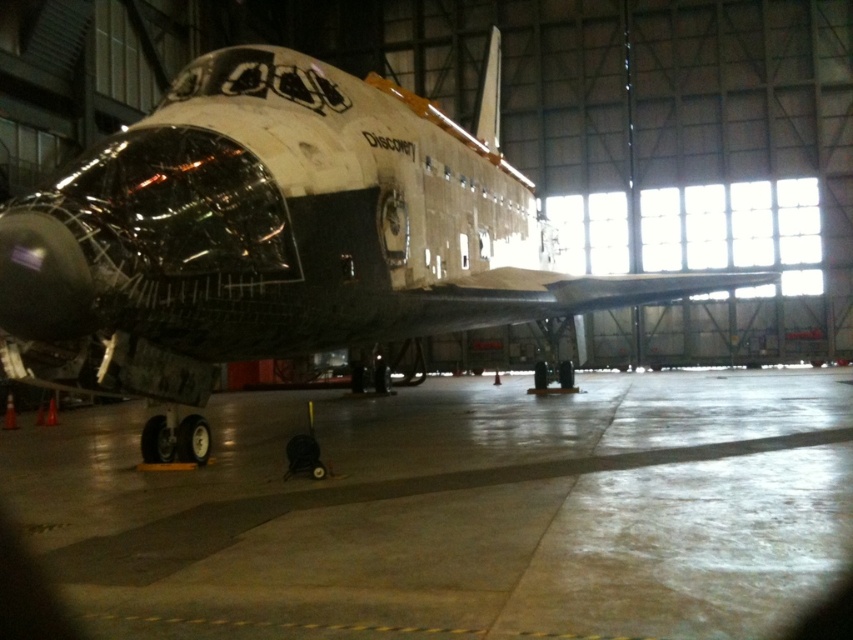
Looking at this image, you are standing at the entrance of the hangar and want to approach the space shuttle Discovery. The concrete at center is the path you need to walk on. If your stride length is 2.5 feet, how many steps will it take you to reach the shuttle from the entrance?

The distance between you and the shuttle is 7.87 feet. With a stride length of 2.5 feet, dividing 7.87 by 2.5 gives approximately 3.15 steps. Since you can only take whole steps, it would take 4 steps to reach the shuttle.

Based on the photo, you are an engineer inspecting the space shuttle Discovery. You need to determine if the concrete at center can support the weight of the white matte space shuttle at center. Based on their heights, can you conclude anything about their weight capacity?

The concrete at center is not as tall as the white matte space shuttle at center, but height does not directly indicate weight capacity. Further information about the materials or structural integrity is needed to determine if the concrete can support the shuttle.